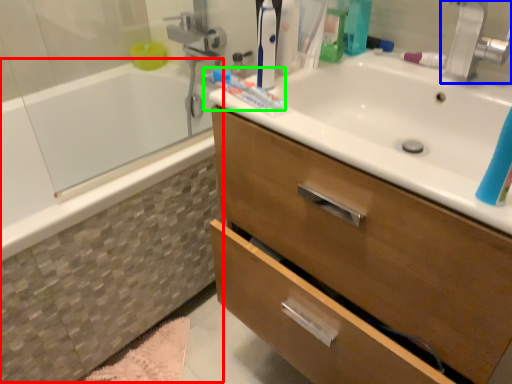
Question: Which object is the closest to the bath (highlighted by a red box)? Choose among these: tap (highlighted by a blue box) or toothpaste (highlighted by a green box).

Choices:
 (A) tap
 (B) toothpaste

Answer: (B)